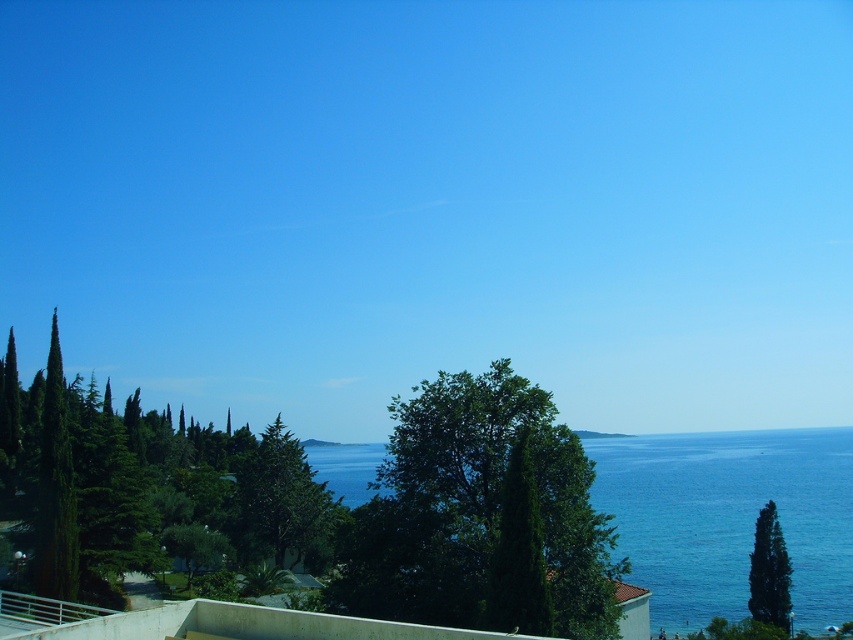
Between blue liquid water at center and green glossy cypress tree at center, which one has less height?

green glossy cypress tree at center

Which is more to the left, blue liquid water at center or green glossy cypress tree at center?

green glossy cypress tree at center

What do you see at coordinates (729, 516) in the screenshot? I see `blue liquid water at center` at bounding box center [729, 516].

At what (x,y) coordinates should I click in order to perform the action: click on blue liquid water at center. Please return your answer as a coordinate pair (x, y). The width and height of the screenshot is (853, 640). Looking at the image, I should click on (729, 516).

Does green matte cypress tree at center have a smaller size compared to green glossy cypress tree at lower right?

No.

Consider the image. Between green matte cypress tree at center and green glossy cypress tree at lower right, which one has less height?

With less height is green glossy cypress tree at lower right.

This screenshot has height=640, width=853. I want to click on green matte cypress tree at center, so click(281, 500).

Is green textured cypress tree at center in front of green matte cypress tree at center?

Yes, green textured cypress tree at center is closer to the viewer.

Between green textured cypress tree at center and green matte cypress tree at center, which one has less height?

green textured cypress tree at center is shorter.

The image size is (853, 640). I want to click on green textured cypress tree at center, so click(x=477, y=508).